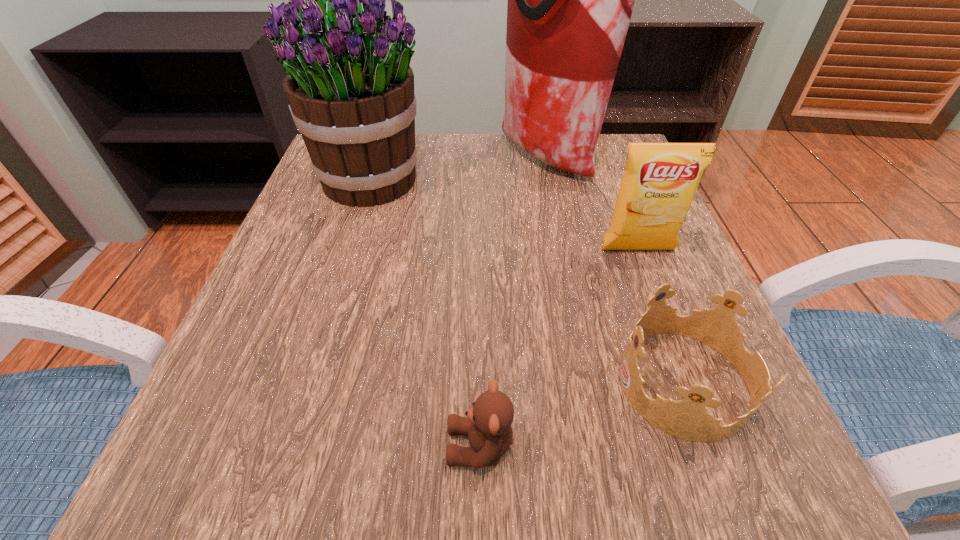
Find the location of a particular element. This screenshot has height=540, width=960. free space at the far right corner of the desktop is located at coordinates (623, 143).

At what (x,y) coordinates should I click in order to perform the action: click on free space at the near right corner of the desktop. Please return your answer as a coordinate pair (x, y). Looking at the image, I should click on (712, 446).

Identify the location of vacant space that is in between the teddy bear and the tiara. (583, 414).

I want to click on free space between the grocery bag and the third farthest object, so click(x=592, y=204).

Identify the location of vacant region between the second object from left to right and the third shortest object. (559, 348).

Locate an element on the screen. The height and width of the screenshot is (540, 960). free spot between the fourth object from right to left and the third shortest object is located at coordinates (559, 348).

Identify the location of empty space between the grocery bag and the second tallest object. (459, 170).

Where is `vacant space that's between the teddy bear and the tiara`? The width and height of the screenshot is (960, 540). vacant space that's between the teddy bear and the tiara is located at coordinates (583, 414).

I want to click on vacant area that lies between the grocery bag and the teddy bear, so click(514, 302).

Identify the location of free space between the grocery bag and the tiara. This screenshot has height=540, width=960. (615, 270).